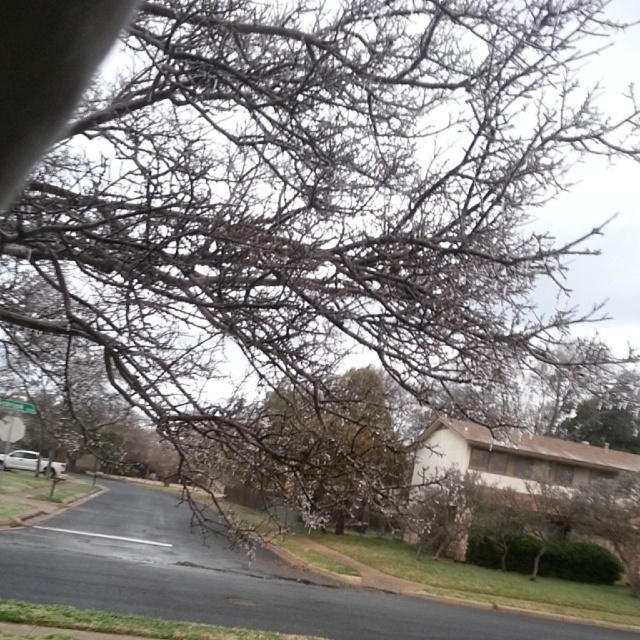
Question: From the image, what is the correct spatial relationship of silver metallic car at lower left in relation to green plastic street sign at lower left?

Choices:
 (A) above
 (B) below

Answer: (B)

Question: Which point is farther to the camera?

Choices:
 (A) green plastic street sign at lower left
 (B) silver metallic car at lower left

Answer: (B)

Question: Where is silver metallic car at lower left located in relation to green plastic street sign at lower left in the image?

Choices:
 (A) below
 (B) above

Answer: (A)

Question: Which point appears farthest from the camera in this image?

Choices:
 (A) (13, 410)
 (B) (3, 456)

Answer: (B)

Question: Which point is farther to the camera?

Choices:
 (A) silver metallic car at lower left
 (B) green plastic street sign at lower left

Answer: (A)

Question: Can you confirm if silver metallic car at lower left is positioned to the left of green plastic street sign at lower left?

Choices:
 (A) no
 (B) yes

Answer: (B)